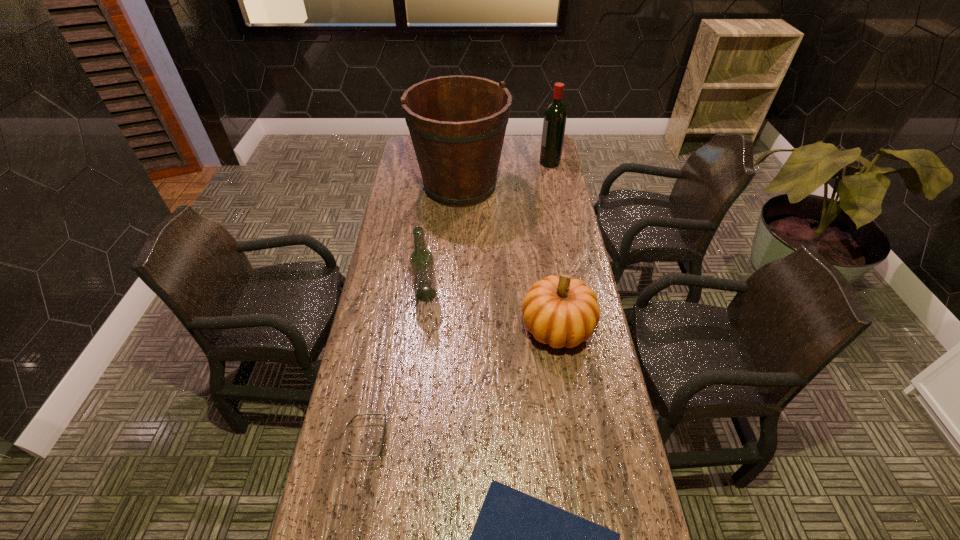
Locate an element on the screen. Image resolution: width=960 pixels, height=540 pixels. vacant area situated 0.160m on the front of the liquor is located at coordinates (420, 342).

This screenshot has width=960, height=540. Identify the location of free spot located on the left of the fourth tallest object. coord(505,328).

Where is `vacant space situated 0.200m on the front-facing side of the sunglasses`? The width and height of the screenshot is (960, 540). vacant space situated 0.200m on the front-facing side of the sunglasses is located at coordinates (462, 438).

You are a GUI agent. You are given a task and a screenshot of the screen. Output one action in this format:
    pyautogui.click(x=<x>, y=<y>)
    Task: Click on the bucket that is at the far edge
    Image resolution: width=960 pixels, height=540 pixels.
    Given the screenshot: What is the action you would take?
    [457, 124]

You are a GUI agent. You are given a task and a screenshot of the screen. Output one action in this format:
    pyautogui.click(x=<x>, y=<y>)
    Task: Click on the wine bottle present at the far edge
    This screenshot has width=960, height=540.
    Given the screenshot: What is the action you would take?
    pyautogui.click(x=555, y=116)

Where is `bucket situated at the left edge`? bucket situated at the left edge is located at coordinates [x=457, y=124].

Identify the location of liquor situated at the left edge. (422, 264).

Locate an element on the screen. The image size is (960, 540). sunglasses located at the left edge is located at coordinates (381, 448).

Identify the location of wine bottle that is at the right edge. This screenshot has height=540, width=960. (555, 116).

Image resolution: width=960 pixels, height=540 pixels. I want to click on pumpkin located in the right edge section of the desktop, so coord(560,311).